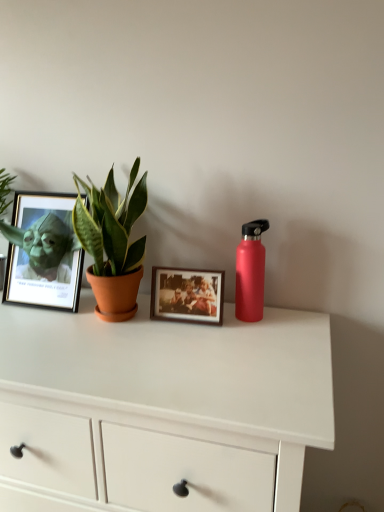
Identify the location of vacant space to the right of matte red water bottle at right. This screenshot has height=512, width=384. (292, 316).